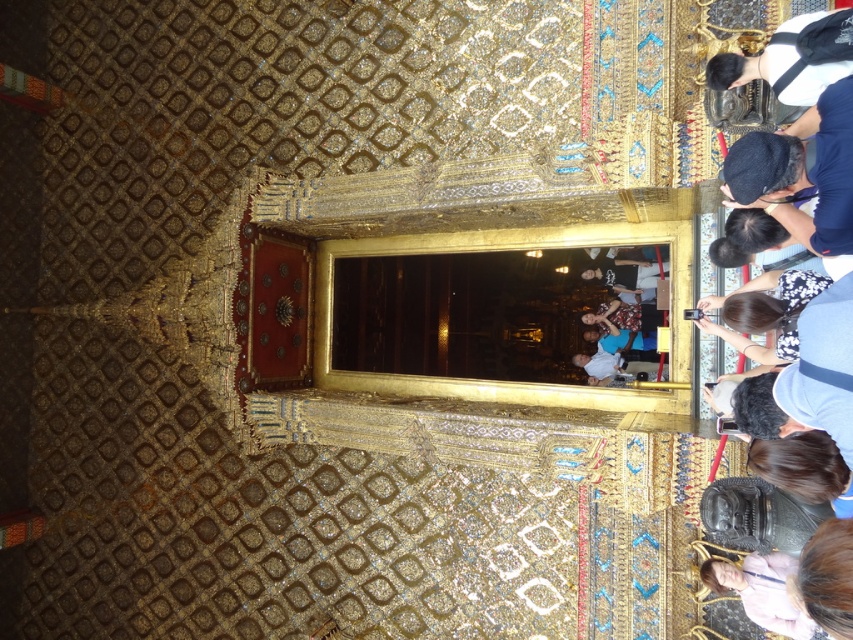
You are an interior designer assessing the decor of this temple. You notice the black fabric cap at upper right and the pink fabric at lower right. Which object is positioned higher in the image?

The black fabric cap at upper right is positioned higher in the image than the pink fabric at lower right.

In the scene shown: You are an architect designing a virtual tour of this temple. You need to place a virtual marker exactly at the position of the black fabric cap at upper right. What are the coordinates where you should place the marker?

The coordinates for the black fabric cap at upper right are at point (801, 173).